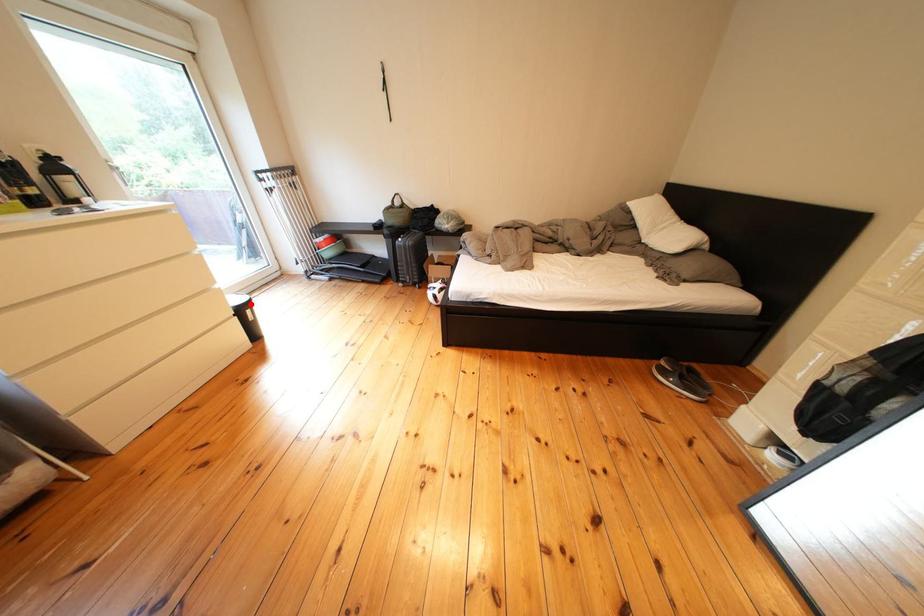
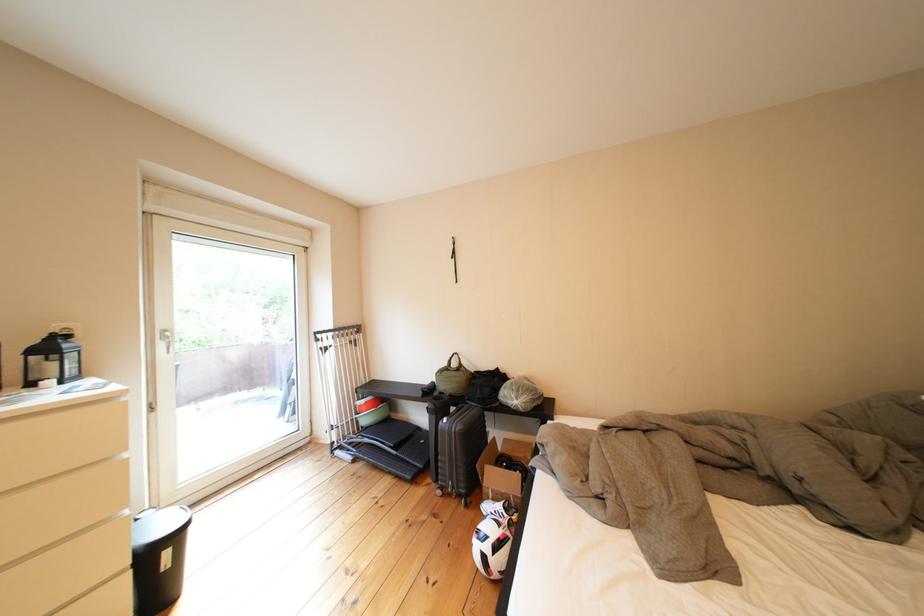
Question: A red point is marked in image1. In image2, is the corresponding 3D point closer to the camera or farther? Reply with the corresponding letter.

Choices:
 (A) The corresponding 3D point is closer.
 (B) The corresponding 3D point is farther.

Answer: (B)